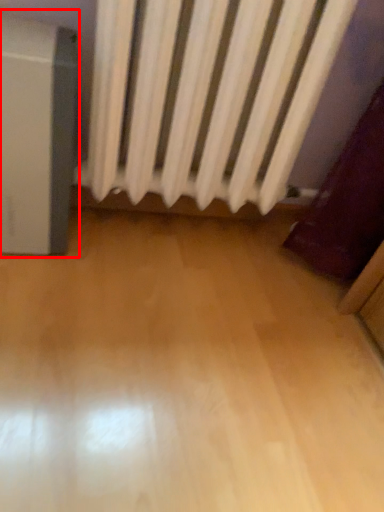
Question: From the image, what is the correct spatial relationship of appliance (annotated by the red box) in relation to curtain?

Choices:
 (A) right
 (B) left

Answer: (B)